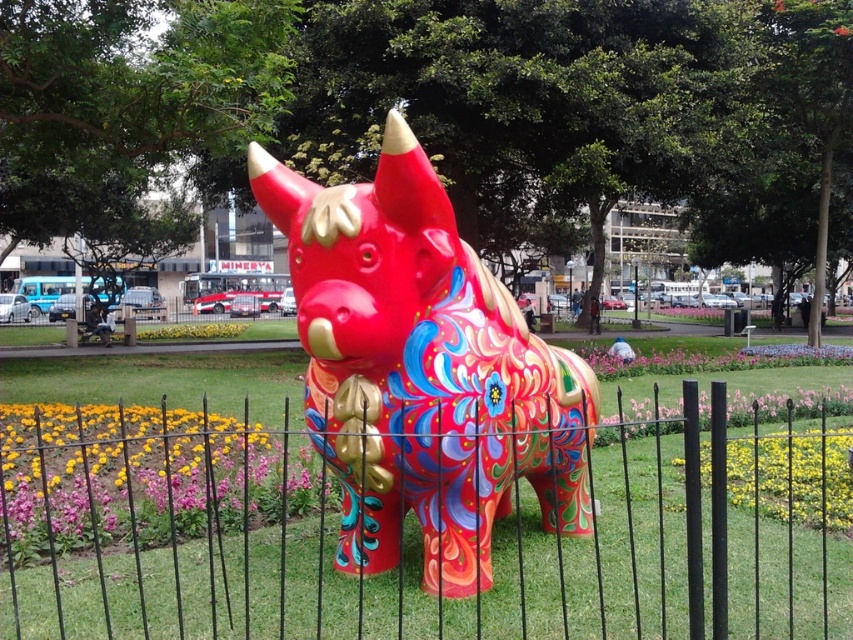
You are a gardener who wants to place a new statue between the shiny plastic bull at center and the yellow matte flower at center. Since the statue must be shorter than both objects, which object should you use as a reference for the maximum height?

The shiny plastic bull at center is much taller than the yellow matte flower at center. Therefore, you should use the yellow matte flower at center as the reference for the maximum height because it is shorter.

You are a gardener trying to water the yellow matte flower at center. You notice the black metal fence at center nearby. Is the fence blocking the sunlight reaching the flower?

The black metal fence at center is positioned under the yellow matte flower at center, so the fence is not blocking the sunlight reaching the flower.